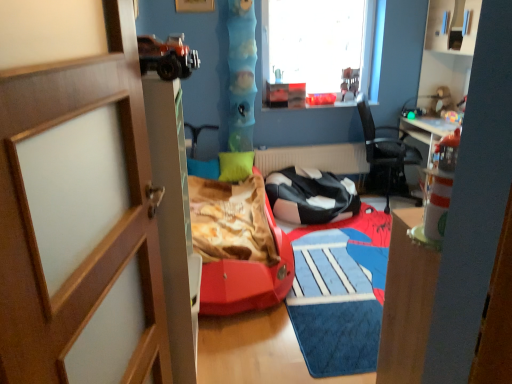
Question: Is black leather chair at center, the 2th chair when ordered from right to left, spatially inside transparent glass window at upper center, or outside of it?

Choices:
 (A) inside
 (B) outside

Answer: (B)

Question: From a real-world perspective, is black leather chair at center, the 2th chair when ordered from right to left, positioned above or below transparent glass window at upper center?

Choices:
 (A) above
 (B) below

Answer: (B)

Question: Based on their relative distances, which object is nearer to the green matte pillow at center?

Choices:
 (A) wooden door at left
 (B) black mesh chair at center, acting as the 2th chair starting from the left
 (C) black leather chair at center, which is the 1th chair in left-to-right order
 (D) smooth blue tube at center, the 2th toy positioned from the right
 (E) transparent glass window at upper center

Answer: (D)

Question: Which of these objects is positioned closest to the black leather chair at center, which is the 1th chair in left-to-right order?

Choices:
 (A) wooden door at left
 (B) white matte radiator at center
 (C) transparent glass window at upper center
 (D) black mesh chair at center, acting as the 2th chair starting from the left
 (E) matte plastic toy at upper right, placed as the first toy when sorted from right to left

Answer: (B)